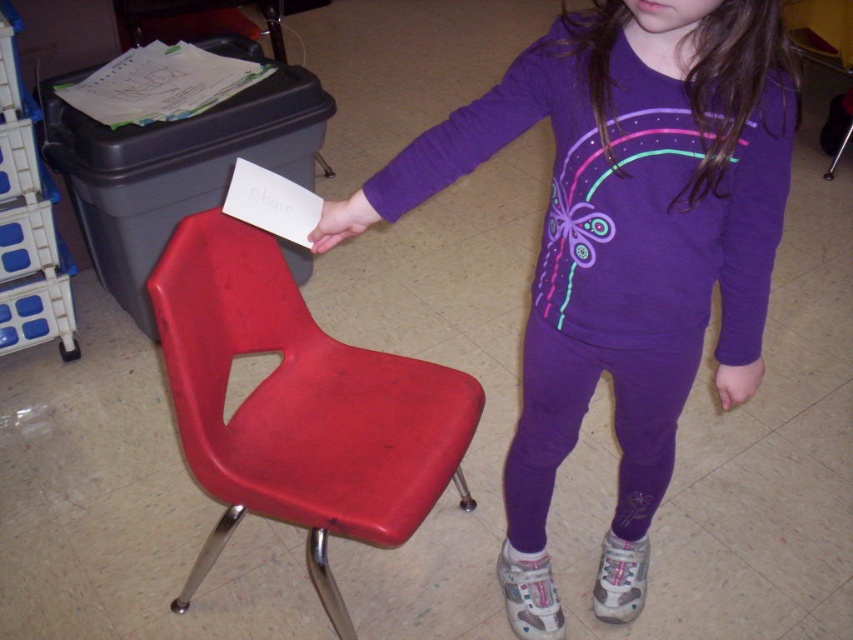
Between purple fleece sweatshirt at upper center and purple matte hand at lower right, which one has more height?

Standing taller between the two is purple fleece sweatshirt at upper center.

Is purple fleece sweatshirt at upper center positioned at the back of purple matte hand at lower right?

That is False.

At what (x,y) coordinates should I click in order to perform the action: click on purple fleece sweatshirt at upper center. Please return your answer as a coordinate pair (x, y). This screenshot has height=640, width=853. Looking at the image, I should click on (625, 248).

Is point (263, 445) more distant than point (737, 397)?

Yes, point (263, 445) is farther from viewer.

The width and height of the screenshot is (853, 640). I want to click on matte plastic chair at left, so click(x=299, y=406).

Locate an element on the screen. The image size is (853, 640). purple fleece sweatshirt at upper center is located at coordinates (625, 248).

Does point (700, 339) lie behind point (346, 205)?

Yes, it is behind point (346, 205).

Measure the distance between point (587, 52) and camera.

The distance of point (587, 52) from camera is 37.23 inches.

Where is `purple fleece sweatshirt at upper center`? This screenshot has height=640, width=853. purple fleece sweatshirt at upper center is located at coordinates (625, 248).